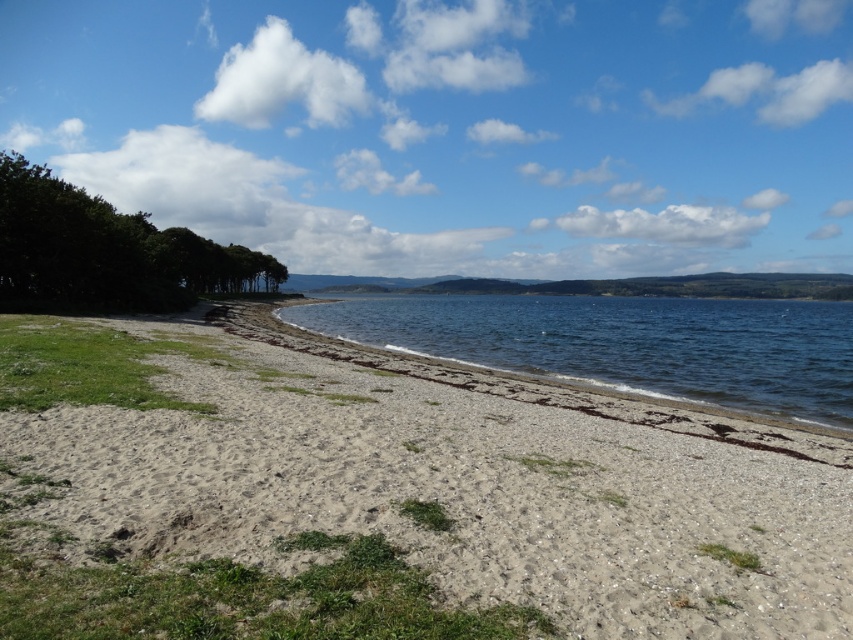
Question: Which point is closer to the camera?

Choices:
 (A) gray gravelly sand at center
 (B) green leafy trees at left

Answer: (A)

Question: Which object is positioned farthest from the green leafy trees at left?

Choices:
 (A) clear water at center
 (B) gray gravelly sand at center

Answer: (A)

Question: Is gray gravelly sand at center below green leafy trees at left?

Choices:
 (A) yes
 (B) no

Answer: (A)

Question: Which point is farther to the camera?

Choices:
 (A) (222, 272)
 (B) (625, 305)
 (C) (843, 618)

Answer: (B)

Question: Is gray gravelly sand at center positioned behind clear water at center?

Choices:
 (A) yes
 (B) no

Answer: (B)

Question: Does gray gravelly sand at center appear over green leafy trees at left?

Choices:
 (A) yes
 (B) no

Answer: (B)